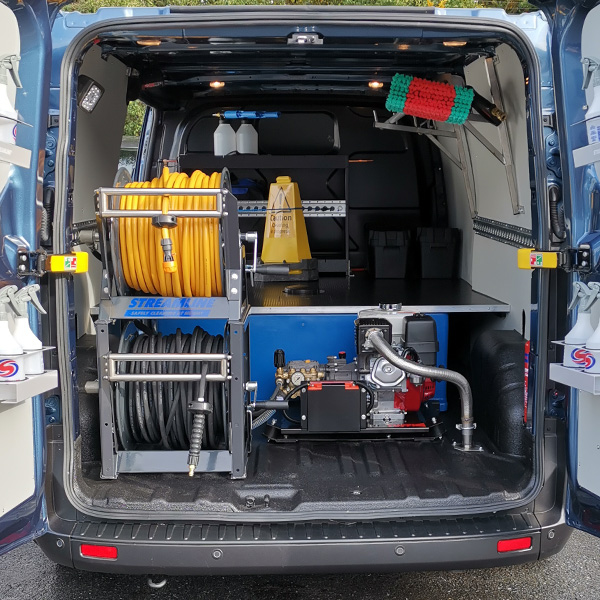
The height and width of the screenshot is (600, 600). In order to click on red and green scrub brush in this screenshot , I will do `click(421, 96)`.